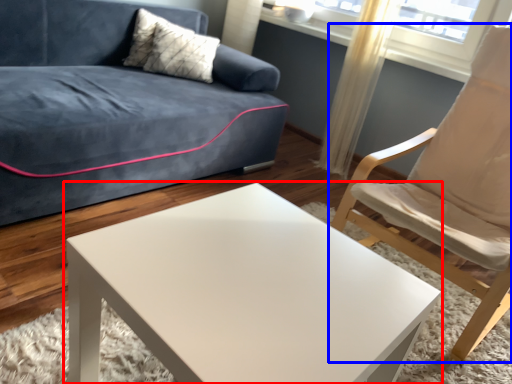
Question: Which of the following is the closest to the observer, coffee table (highlighted by a red box) or chair (highlighted by a blue box)?

Choices:
 (A) coffee table
 (B) chair

Answer: (A)